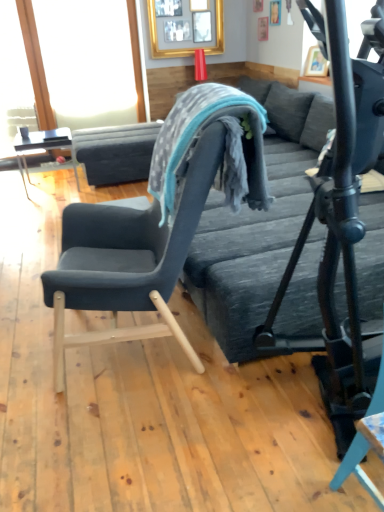
At what (x,y) coordinates should I click in order to perform the action: click on velvet dark blue chair at left. Please return your answer as a coordinate pair (x, y). This screenshot has height=512, width=384. Looking at the image, I should click on (152, 225).

What do you see at coordinates (91, 59) in the screenshot? This screenshot has height=512, width=384. I see `transparent glass window screen at upper left` at bounding box center [91, 59].

Find the location of a particular element. The height and width of the screenshot is (512, 384). matte black table at left is located at coordinates (44, 145).

Describe the element at coordinates (257, 224) in the screenshot. I see `textured gray bed frame at center` at that location.

The image size is (384, 512). I want to click on gold-framed picture at upper center, so click(184, 31).

Measure the distance between gold-framed picture at upper center and camera.

A distance of 4.82 meters exists between gold-framed picture at upper center and camera.

What is the approximate height of textured gray bean bag chair at center?

textured gray bean bag chair at center is 20.95 inches in height.

Find the location of a particular element. This screenshot has width=384, height=512. velvet dark blue chair at left is located at coordinates (152, 225).

Choose the correct answer: Is textured gray bed frame at center inside gold-framed picture at upper center or outside it?

textured gray bed frame at center is not inside gold-framed picture at upper center, it's outside.

Is textured gray bed frame at center to the right of gold-framed picture at upper center from the viewer's perspective?

Correct, you'll find textured gray bed frame at center to the right of gold-framed picture at upper center.

Looking at this image, can you confirm if textured gray bed frame at center is bigger than gold-framed picture at upper center?

Yes, textured gray bed frame at center is bigger than gold-framed picture at upper center.

Is textured gray bed frame at center far away from gold-framed picture at upper center?

Result: Yes.

I want to click on window screen above the velvet dark blue chair at left (from a real-world perspective), so click(x=91, y=59).

Is velvet dark blue chair at left thinner than transparent glass window screen at upper left?

No.

Between velvet dark blue chair at left and transparent glass window screen at upper left, which one has larger size?

velvet dark blue chair at left.

Does velvet dark blue chair at left lie in front of transparent glass window screen at upper left?

Yes, it is in front of transparent glass window screen at upper left.

From the picture: How distant is velvet dark blue chair at left from gold-framed picture at upper center?

3.75 meters.

Which object is further away from the camera, velvet dark blue chair at left or gold-framed picture at upper center?

gold-framed picture at upper center.

You are a GUI agent. You are given a task and a screenshot of the screen. Output one action in this format:
    pyautogui.click(x=<x>, y=<y>)
    Task: Click on the picture frame that is above the velvet dark blue chair at left (from a real-world perspective)
    
    Given the screenshot: What is the action you would take?
    pyautogui.click(x=184, y=31)

From the image's perspective, between velvet dark blue chair at left and gold-framed picture at upper center, who is located below?

velvet dark blue chair at left, from the image's perspective.

Does transparent glass window screen at upper left appear on the left side of textured gray bed frame at center?

Indeed, transparent glass window screen at upper left is positioned on the left side of textured gray bed frame at center.

Image resolution: width=384 pixels, height=512 pixels. I want to click on window screen above the textured gray bed frame at center (from a real-world perspective), so click(x=91, y=59).

From their relative heights in the image, would you say transparent glass window screen at upper left is taller or shorter than textured gray bed frame at center?

Clearly, transparent glass window screen at upper left is taller compared to textured gray bed frame at center.

From the picture: Between transparent glass window screen at upper left and textured gray bed frame at center, which one has smaller size?

With smaller size is transparent glass window screen at upper left.

Is gold-framed picture at upper center touching matte black table at left?

No, gold-framed picture at upper center is not beside matte black table at left.

Which is behind, point (216, 35) or point (33, 143)?

The point (216, 35) is more distant.

Looking at this image, is gold-framed picture at upper center taller than matte black table at left?

Correct, gold-framed picture at upper center is much taller as matte black table at left.

From the image's perspective, between gold-framed picture at upper center and textured gray bean bag chair at center, which one is located above?

gold-framed picture at upper center appears higher in the image.

Is gold-framed picture at upper center at the right side of textured gray bean bag chair at center?

No, gold-framed picture at upper center is not to the right of textured gray bean bag chair at center.

At what (x,y) coordinates should I click in order to perform the action: click on bean bag chair below the gold-framed picture at upper center (from a real-world perspective). Please return your answer as a coordinate pair (x, y). Looking at the image, I should click on (198, 138).

What's the angular difference between gold-framed picture at upper center and textured gray bean bag chair at center's facing directions?

The facing directions of gold-framed picture at upper center and textured gray bean bag chair at center are 97.2 degrees apart.

Consider the image. From a real-world perspective, which object rests below the other?

textured gray bed frame at center, from a real-world perspective.

In the scene shown: Between textured gray bean bag chair at center and textured gray bed frame at center, which one has more height?

textured gray bed frame at center.

Which object is closer to the camera, textured gray bean bag chair at center or textured gray bed frame at center?

textured gray bean bag chair at center is closer to the camera.

This screenshot has width=384, height=512. Identify the location of bed frame below the textured gray bean bag chair at center (from the image's perspective). (257, 224).

The image size is (384, 512). Identify the location of bed frame below the gold-framed picture at upper center (from the image's perspective). (257, 224).

Identify the location of chair that is on the right side of transparent glass window screen at upper left. Image resolution: width=384 pixels, height=512 pixels. (152, 225).

Which object lies further to the anchor point textured gray bed frame at center, textured gray bean bag chair at center or velvet dark blue chair at left?

Based on the image, velvet dark blue chair at left appears to be further to textured gray bed frame at center.

When comparing their distances from matte black table at left, does gold-framed picture at upper center or transparent glass window screen at upper left seem further?

gold-framed picture at upper center lies further to matte black table at left than the other object.

Based on their spatial positions, is gold-framed picture at upper center or velvet dark blue chair at left further from textured gray bean bag chair at center?

gold-framed picture at upper center.

From the image, which object appears to be nearer to gold-framed picture at upper center, velvet dark blue chair at left or matte black table at left?

Based on the image, matte black table at left appears to be nearer to gold-framed picture at upper center.

Estimate the real-world distances between objects in this image. Which object is closer to textured gray bed frame at center, gold-framed picture at upper center or transparent glass window screen at upper left?

Based on the image, gold-framed picture at upper center appears to be nearer to textured gray bed frame at center.

Estimate the real-world distances between objects in this image. Which object is closer to transparent glass window screen at upper left, textured gray bed frame at center or textured gray bean bag chair at center?

Among the two, textured gray bed frame at center is located nearer to transparent glass window screen at upper left.

Estimate the real-world distances between objects in this image. Which object is further from transparent glass window screen at upper left, velvet dark blue chair at left or gold-framed picture at upper center?

velvet dark blue chair at left is positioned further to the anchor transparent glass window screen at upper left.

Looking at the image, which one is located further to transparent glass window screen at upper left, gold-framed picture at upper center or textured gray bed frame at center?

textured gray bed frame at center is positioned further to the anchor transparent glass window screen at upper left.

Find the location of `table located between textured gray bean bag chair at center and gold-framed picture at upper center in the depth direction`. table located between textured gray bean bag chair at center and gold-framed picture at upper center in the depth direction is located at coordinates (44, 145).

The height and width of the screenshot is (512, 384). I want to click on bed frame located between velvet dark blue chair at left and transparent glass window screen at upper left in the depth direction, so click(257, 224).

Find the location of a particular element. This screenshot has height=512, width=384. window screen between textured gray bed frame at center and gold-framed picture at upper center from front to back is located at coordinates (91, 59).

I want to click on window screen between velvet dark blue chair at left and gold-framed picture at upper center in the front-back direction, so click(x=91, y=59).